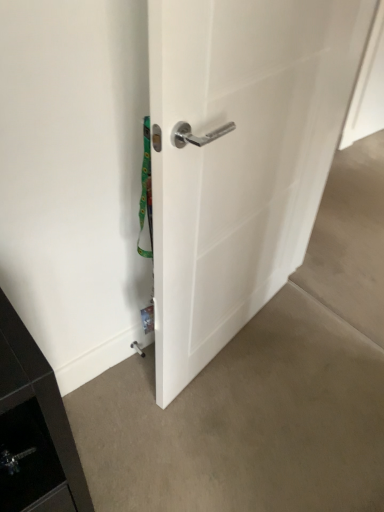
Question: Is white glossy door handle at center turned away from smooth concrete floor at lower right, the 2th concrete ordered from the bottom?

Choices:
 (A) yes
 (B) no

Answer: (B)

Question: Are white glossy door handle at center and smooth concrete floor at lower right, the 2th concrete ordered from the bottom, located far from each other?

Choices:
 (A) no
 (B) yes

Answer: (A)

Question: Could smooth concrete floor at lower right, the 2th concrete ordered from the bottom, be considered to be inside white glossy door handle at center?

Choices:
 (A) yes
 (B) no

Answer: (B)

Question: Does white glossy door handle at center have a smaller size compared to smooth concrete floor at lower right, the 1th concrete in the top-to-bottom sequence?

Choices:
 (A) yes
 (B) no

Answer: (A)

Question: From the image's perspective, is white glossy door handle at center over smooth concrete floor at lower right, the 2th concrete ordered from the bottom?

Choices:
 (A) yes
 (B) no

Answer: (B)

Question: Does white glossy door handle at center appear on the right side of smooth concrete floor at lower right, the 2th concrete ordered from the bottom?

Choices:
 (A) yes
 (B) no

Answer: (B)

Question: From a real-world perspective, is smooth concrete floor at lower right, the 1th concrete in the top-to-bottom sequence, over light brown carpet at lower center, which is the first concrete in bottom-to-top order?

Choices:
 (A) no
 (B) yes

Answer: (B)

Question: Can you confirm if smooth concrete floor at lower right, the 2th concrete ordered from the bottom, is taller than light brown carpet at lower center, which appears as the 2th concrete when viewed from the top?

Choices:
 (A) yes
 (B) no

Answer: (A)

Question: Can you confirm if smooth concrete floor at lower right, the 2th concrete ordered from the bottom, is wider than light brown carpet at lower center, which appears as the 2th concrete when viewed from the top?

Choices:
 (A) no
 (B) yes

Answer: (A)

Question: Does smooth concrete floor at lower right, the 2th concrete ordered from the bottom, appear on the left side of light brown carpet at lower center, which appears as the 2th concrete when viewed from the top?

Choices:
 (A) yes
 (B) no

Answer: (B)

Question: Is smooth concrete floor at lower right, the 1th concrete in the top-to-bottom sequence, smaller than light brown carpet at lower center, which is the first concrete in bottom-to-top order?

Choices:
 (A) yes
 (B) no

Answer: (B)

Question: Does smooth concrete floor at lower right, the 2th concrete ordered from the bottom, appear on the right side of light brown carpet at lower center, which is the first concrete in bottom-to-top order?

Choices:
 (A) no
 (B) yes

Answer: (B)

Question: Are white glossy door handle at center and light brown carpet at lower center, which appears as the 2th concrete when viewed from the top, beside each other?

Choices:
 (A) yes
 (B) no

Answer: (B)